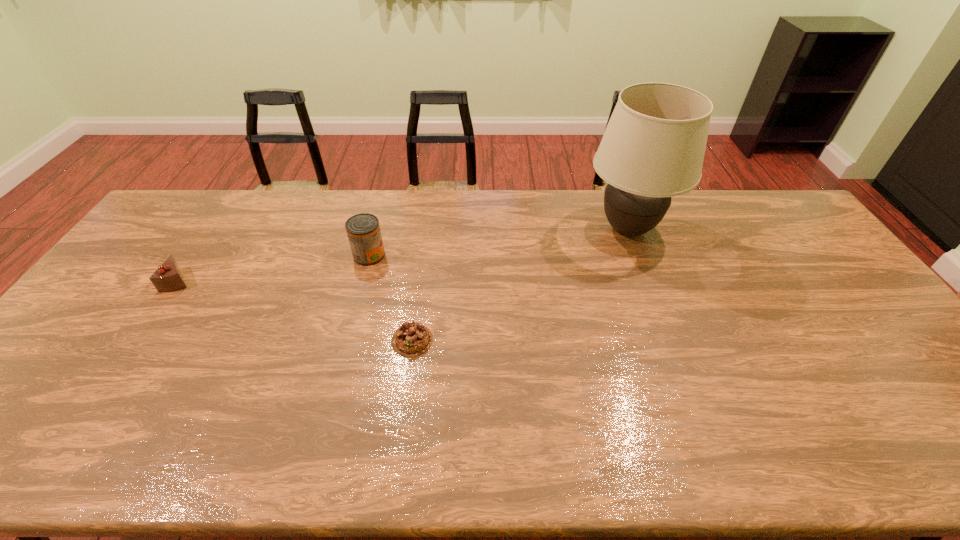
What are the coordinates of `vacant area situated 0.210m on the front of the second shortest object` in the screenshot? It's located at click(x=131, y=352).

Locate an element on the screen. This screenshot has height=540, width=960. vacant space situated 0.080m on the left of the shorter chocolate cake is located at coordinates (361, 340).

Image resolution: width=960 pixels, height=540 pixels. In order to click on object that is at the far edge in this screenshot , I will do `click(653, 148)`.

In the image, there is a desktop. Where is `free space at the far edge`? This screenshot has width=960, height=540. free space at the far edge is located at coordinates (731, 217).

Identify the location of free spot at the near edge of the desktop. The width and height of the screenshot is (960, 540). (378, 449).

Locate an element on the screen. vacant space at the left edge is located at coordinates (67, 332).

Image resolution: width=960 pixels, height=540 pixels. In order to click on free region at the right edge of the desktop in this screenshot , I will do `click(838, 289)`.

You are a GUI agent. You are given a task and a screenshot of the screen. Output one action in this format:
    pyautogui.click(x=<x>, y=<y>)
    Task: Click on the free space at the far left corner
    
    Given the screenshot: What is the action you would take?
    pyautogui.click(x=187, y=209)

You are a GUI agent. You are given a task and a screenshot of the screen. Output one action in this format:
    pyautogui.click(x=<x>, y=<y>)
    Task: Click on the free space between the shortest object and the third object from right to left
    
    Given the screenshot: What is the action you would take?
    pyautogui.click(x=391, y=298)

Find the location of a particular element. This screenshot has width=960, height=540. vacant space that is in between the right chocolate cake and the lampshade is located at coordinates (519, 285).